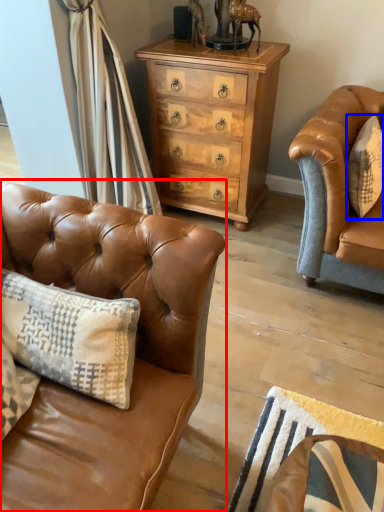
Question: Which object is closer to the camera taking this photo, studio couch (highlighted by a red box) or pillow (highlighted by a blue box)?

Choices:
 (A) studio couch
 (B) pillow

Answer: (A)